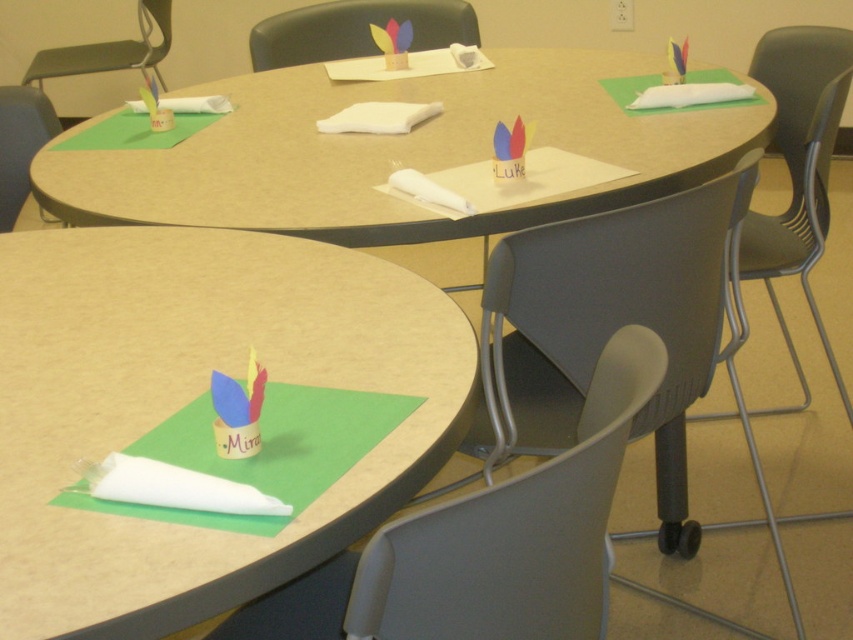
Does matte cardboard table at center have a greater height compared to matte blue paper cup at lower left?

Yes, matte cardboard table at center is taller than matte blue paper cup at lower left.

Does matte cardboard table at center have a greater width compared to matte blue paper cup at lower left?

Yes.

Does point (39, 157) lie behind point (225, 436)?

Yes, it is behind point (225, 436).

The height and width of the screenshot is (640, 853). In order to click on matte cardboard table at center in this screenshot , I will do `click(395, 152)`.

Which is more to the right, matte plastic chair at upper center or matte plastic chair at left?

matte plastic chair at upper center is more to the right.

Is matte plastic chair at upper center above matte plastic chair at left?

Yes, matte plastic chair at upper center is above matte plastic chair at left.

Does point (352, 22) come closer to viewer compared to point (38, 144)?

No.

In order to click on matte plastic chair at upper center in this screenshot , I will do `click(357, 29)`.

Who is taller, matte cardboard table at center or metallic gray chair at upper left?

Standing taller between the two is matte cardboard table at center.

Does matte cardboard table at center have a lesser height compared to metallic gray chair at upper left?

No.

Is point (268, 225) positioned in front of point (93, 72)?

Yes, it is in front of point (93, 72).

Find the location of a particular element. The image size is (853, 640). matte cardboard table at center is located at coordinates (395, 152).